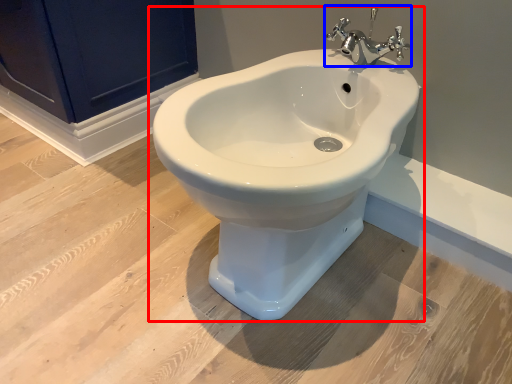
Question: Among these objects, which one is farthest to the camera, toilet (highlighted by a red box) or tap (highlighted by a blue box)?

Choices:
 (A) toilet
 (B) tap

Answer: (B)